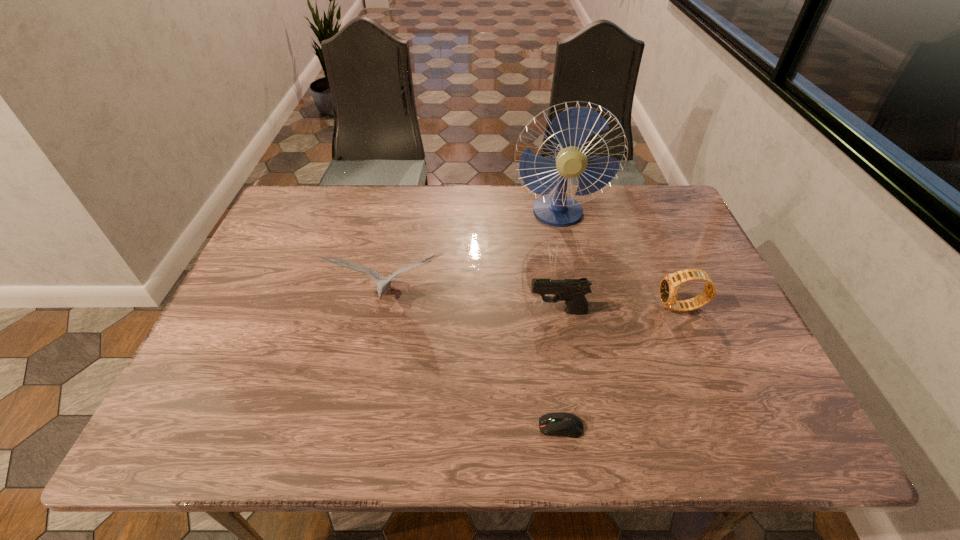
The image size is (960, 540). In order to click on blank space located on the face of the rightmost object in this screenshot , I will do `click(606, 308)`.

You are a GUI agent. You are given a task and a screenshot of the screen. Output one action in this format:
    pyautogui.click(x=<x>, y=<y>)
    Task: Click on the vacant space situated on the face of the rightmost object
    The height and width of the screenshot is (540, 960).
    Given the screenshot: What is the action you would take?
    pyautogui.click(x=582, y=308)

This screenshot has width=960, height=540. What are the coordinates of `vacant area situated on the face of the rightmost object` in the screenshot? It's located at (598, 308).

Find the location of a particular element. This screenshot has width=960, height=540. vacant region located 0.340m at the barrel of the pistol is located at coordinates (391, 312).

I want to click on free space located at the barrel of the pistol, so click(x=496, y=312).

Identify the location of free point located 0.050m at the barrel of the pistol. pos(509,312).

The width and height of the screenshot is (960, 540). I want to click on free space located on the button of the nearest object, so click(503, 427).

The height and width of the screenshot is (540, 960). Identify the location of vacant point located 0.220m on the button of the nearest object. (428, 427).

This screenshot has height=540, width=960. Identify the location of free space located on the button of the nearest object. (388, 427).

This screenshot has width=960, height=540. What are the coordinates of `object present at the far edge` in the screenshot? It's located at (571, 128).